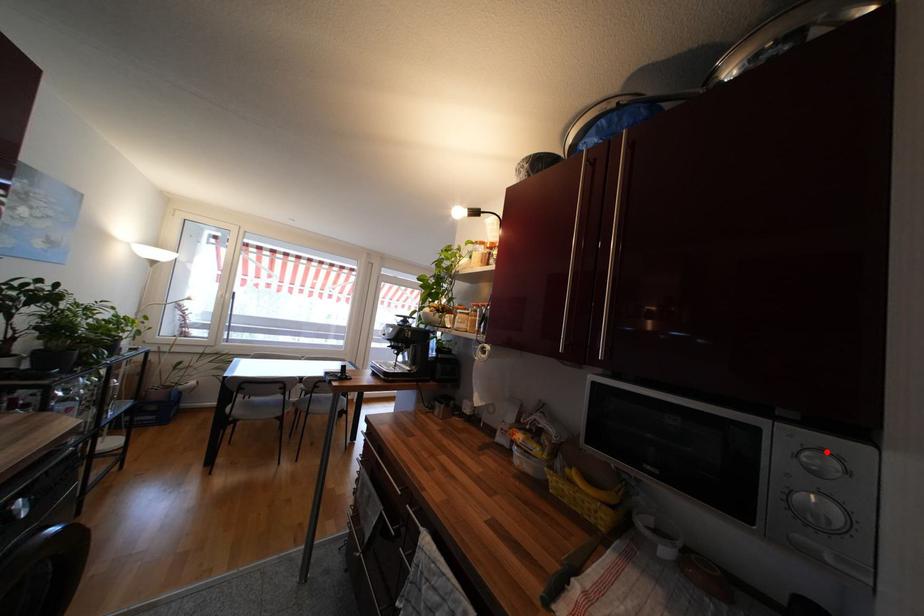
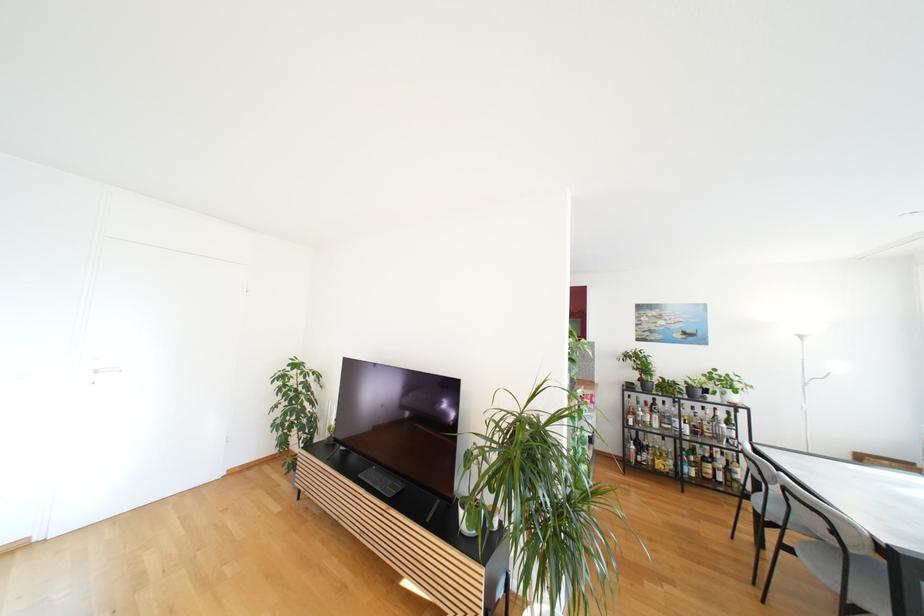
Question: I am providing you with two images of the same scene from different viewpoints. A red point is marked on the first image. Can you still see the location of the red point in image 2?

Choices:
 (A) Yes
 (B) No

Answer: (B)